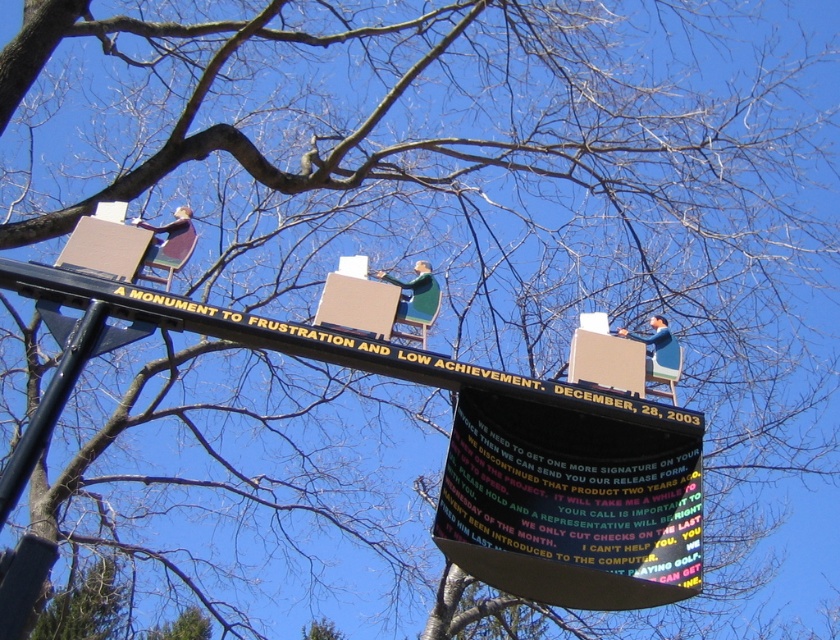
You are an artist planning to hang two signs on your gallery wall. You have a black plastic sign at center and a black painted wood signboard at center. If you want to use a thinner material for one of them, which one should you choose?

The black plastic sign at center is thinner than the black painted wood signboard at center, so you should choose the black plastic sign at center for the thinner material.

You are standing at the base of the monument and want to place a flower at the point closest to the ground. Which point should you choose between point (583, 545) and point (29, 292)?

Point (29, 292) is closer to the ground, so you should place the flower there.

You are standing in front of the monument described in the scene. Which object would appear larger to you, the black plastic sign at center or the black painted wood signboard at center?

The black plastic sign at center appears larger because it is closer to the viewer than the black painted wood signboard at center.